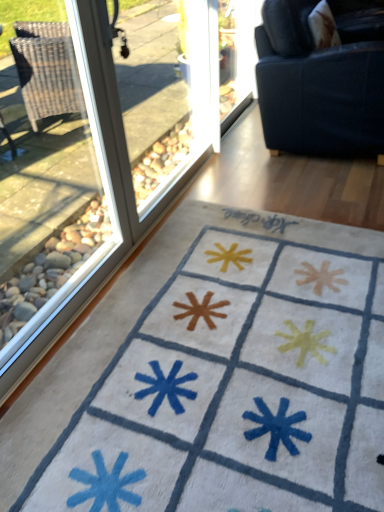
Question: Does transparent glass screen door at upper center come in front of transparent glass window at left?

Choices:
 (A) yes
 (B) no

Answer: (B)

Question: Can you confirm if transparent glass screen door at upper center is smaller than transparent glass window at left?

Choices:
 (A) no
 (B) yes

Answer: (B)

Question: Does transparent glass screen door at upper center have a greater width compared to transparent glass window at left?

Choices:
 (A) no
 (B) yes

Answer: (A)

Question: From the image's perspective, does transparent glass screen door at upper center appear higher than transparent glass window at left?

Choices:
 (A) yes
 (B) no

Answer: (A)

Question: Does transparent glass screen door at upper center have a lesser height compared to transparent glass window at left?

Choices:
 (A) yes
 (B) no

Answer: (A)

Question: Would you say transparent glass screen door at upper center is inside or outside dark blue fabric couch at upper right?

Choices:
 (A) outside
 (B) inside

Answer: (A)

Question: In the image, is transparent glass screen door at upper center positioned in front of or behind dark blue fabric couch at upper right?

Choices:
 (A) behind
 (B) front

Answer: (A)

Question: Is transparent glass screen door at upper center wider or thinner than dark blue fabric couch at upper right?

Choices:
 (A) wide
 (B) thin

Answer: (B)

Question: Considering the positions of transparent glass screen door at upper center and dark blue fabric couch at upper right in the image, is transparent glass screen door at upper center bigger or smaller than dark blue fabric couch at upper right?

Choices:
 (A) small
 (B) big

Answer: (A)

Question: Is transparent glass screen door at upper center taller or shorter than transparent glass window at left?

Choices:
 (A) short
 (B) tall

Answer: (A)

Question: Does point (231, 32) appear closer or farther from the camera than point (46, 236)?

Choices:
 (A) farther
 (B) closer

Answer: (A)

Question: Relative to transparent glass window at left, is transparent glass screen door at upper center in front or behind?

Choices:
 (A) behind
 (B) front

Answer: (A)

Question: From the image's perspective, is transparent glass screen door at upper center positioned above or below transparent glass window at left?

Choices:
 (A) below
 (B) above

Answer: (B)

Question: Considering the positions of transparent glass window at left and dark blue fabric couch at upper right in the image, is transparent glass window at left wider or thinner than dark blue fabric couch at upper right?

Choices:
 (A) wide
 (B) thin

Answer: (B)

Question: Considering the positions of transparent glass window at left and dark blue fabric couch at upper right in the image, is transparent glass window at left taller or shorter than dark blue fabric couch at upper right?

Choices:
 (A) tall
 (B) short

Answer: (A)